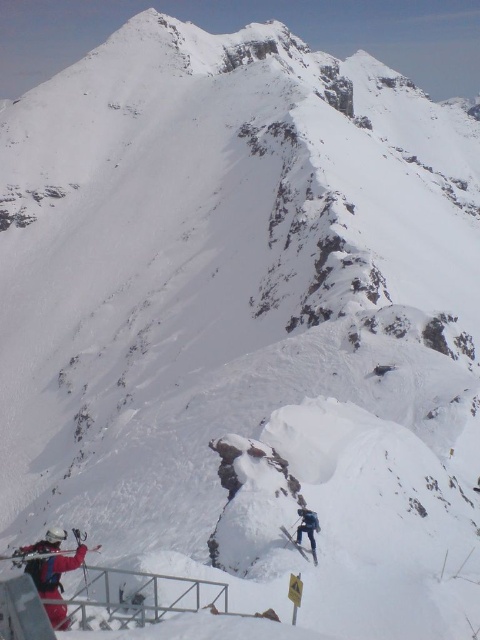
Which is more to the left, red fabric jacket at lower left or dark blue ski suit at center?

From the viewer's perspective, red fabric jacket at lower left appears more on the left side.

Can you confirm if red fabric jacket at lower left is wider than dark blue ski suit at center?

Yes.

Is point (50, 586) behind point (312, 515)?

No, it is in front of (312, 515).

You are a GUI agent. You are given a task and a screenshot of the screen. Output one action in this format:
    pyautogui.click(x=<x>, y=<y>)
    Task: Click on the red fabric jacket at lower left
    The height and width of the screenshot is (640, 480).
    Given the screenshot: What is the action you would take?
    pyautogui.click(x=51, y=561)